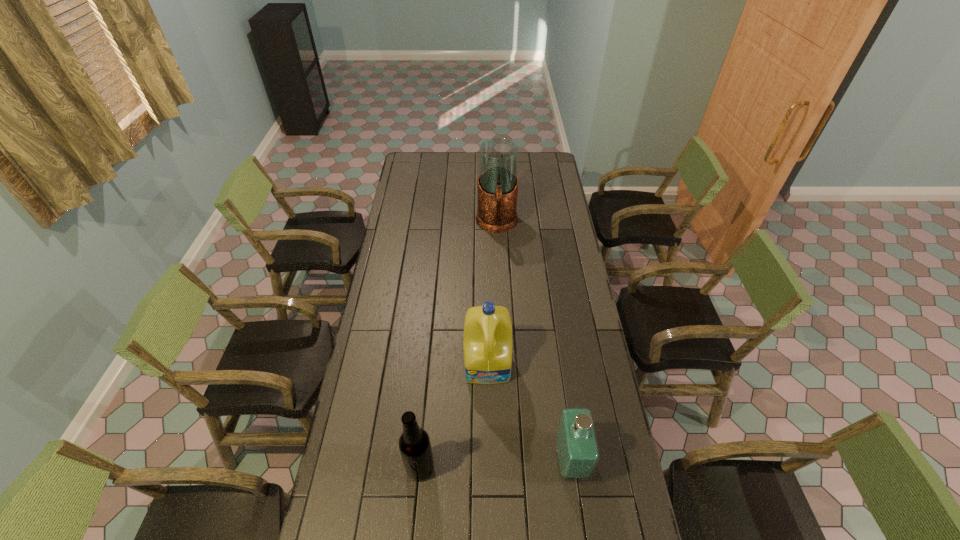
You are a GUI agent. You are given a task and a screenshot of the screen. Output one action in this format:
    pyautogui.click(x=<x>, y=<y>)
    Task: Click on the free space on the desktop that is between the beer bottle and the perfume and is positioned with the handle on the side of the farthest object
    The height and width of the screenshot is (540, 960).
    Given the screenshot: What is the action you would take?
    pyautogui.click(x=504, y=464)

The image size is (960, 540). Find the location of `free space on the desktop that is between the leftmost object and the rightmost object and is positioned on the label of the third nearest object`. free space on the desktop that is between the leftmost object and the rightmost object and is positioned on the label of the third nearest object is located at coordinates (492, 464).